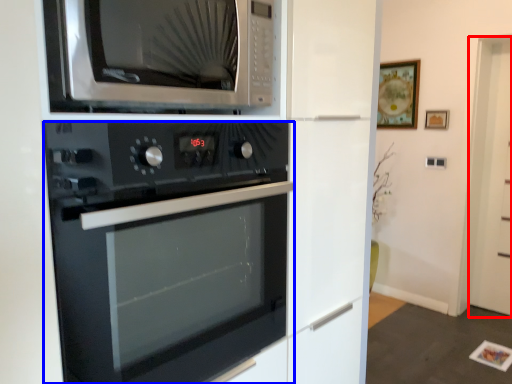
Question: Which point is further to the camera, glass door (highlighted by a red box) or oven (highlighted by a blue box)?

Choices:
 (A) glass door
 (B) oven

Answer: (A)